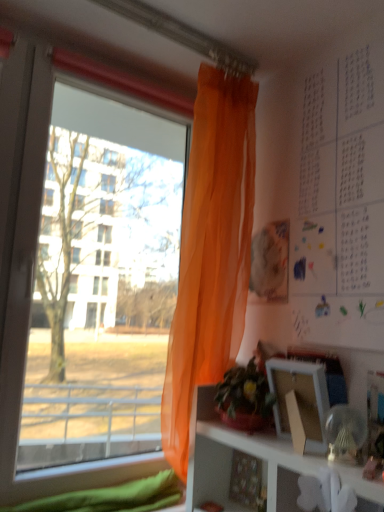
Question: From a real-world perspective, is translucent orange curtain at left physically located above or below white paper at upper right?

Choices:
 (A) below
 (B) above

Answer: (A)

Question: Based on their sizes in the image, would you say translucent orange curtain at left is bigger or smaller than white paper at upper right?

Choices:
 (A) big
 (B) small

Answer: (A)

Question: Estimate the real-world distances between objects in this image. Which object is closer to the white paper at upper right?

Choices:
 (A) white matte picture frame at lower right
 (B) green leafy plant at center
 (C) translucent orange curtain at left
 (D) transparent orange curtain at left

Answer: (C)

Question: Which of these objects is positioned closest to the translucent orange curtain at left?

Choices:
 (A) green leafy plant at center
 (B) white paper at upper right
 (C) transparent orange curtain at left
 (D) white matte picture frame at lower right

Answer: (B)